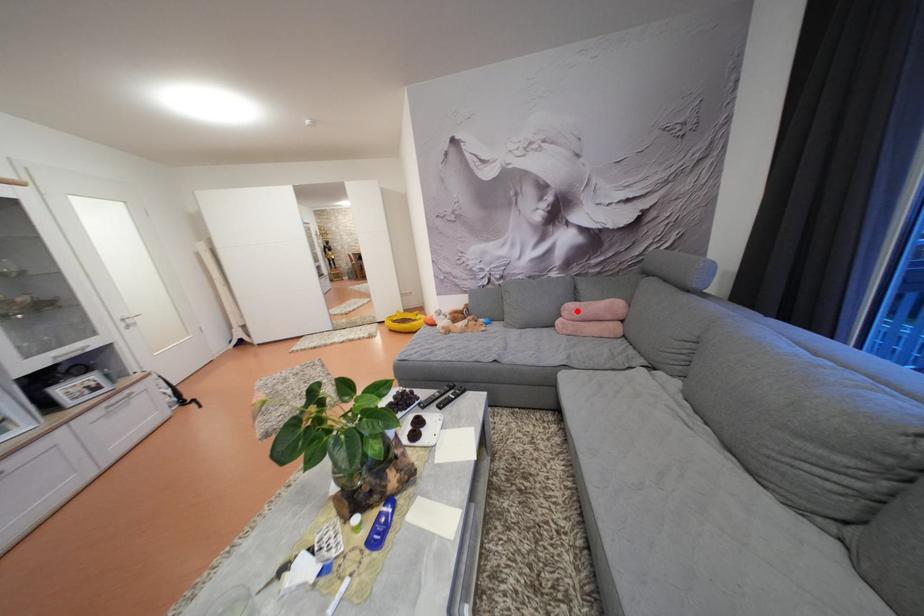
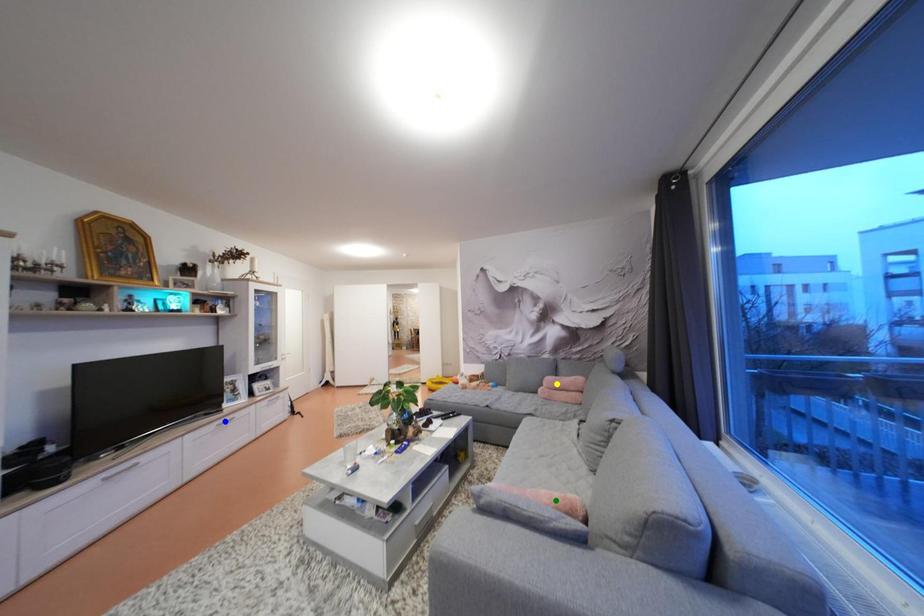
Question: I am providing you with two images of the same scene from different viewpoints. A red point is marked on the first image. You are given multiple points on the second image. Can you choose the point in image 2 that corresponds to the point in image 1?

Choices:
 (A) yellow point
 (B) green point
 (C) blue point

Answer: (A)